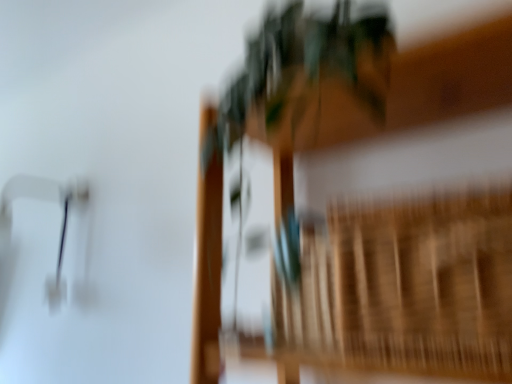
What do you see at coordinates (365, 207) in the screenshot? This screenshot has width=512, height=384. I see `wooden chair at upper center` at bounding box center [365, 207].

In order to click on wooden chair at upper center in this screenshot , I will do `click(365, 207)`.

Where is `wooden chair at upper center`? The width and height of the screenshot is (512, 384). wooden chair at upper center is located at coordinates (365, 207).